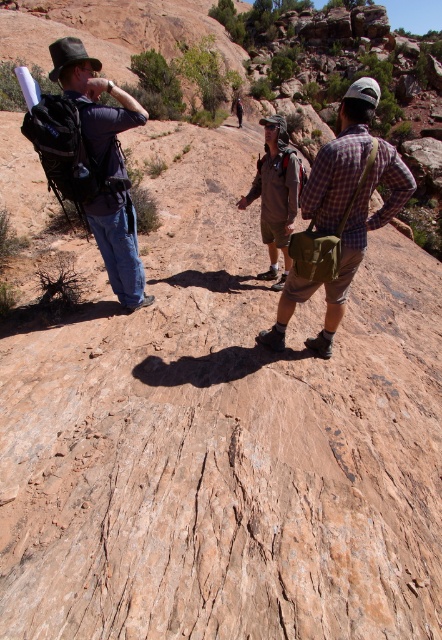
Question: Which point is farther from the camera taking this photo?

Choices:
 (A) (278, 189)
 (B) (358, 186)

Answer: (A)

Question: Can you confirm if matte black backpack at left is bigger than brown suede jacket at center?

Choices:
 (A) no
 (B) yes

Answer: (A)

Question: Which of these objects is positioned farthest from the matte black backpack at left?

Choices:
 (A) brown suede jacket at center
 (B) plaid cotton shirt at center

Answer: (A)

Question: Can you confirm if matte black backpack at left is positioned to the left of brown suede jacket at center?

Choices:
 (A) no
 (B) yes

Answer: (B)

Question: Which object is closer to the camera taking this photo?

Choices:
 (A) plaid cotton shirt at center
 (B) brown suede jacket at center
 (C) matte black backpack at left

Answer: (A)

Question: Does plaid cotton shirt at center appear over matte black backpack at left?

Choices:
 (A) no
 (B) yes

Answer: (B)